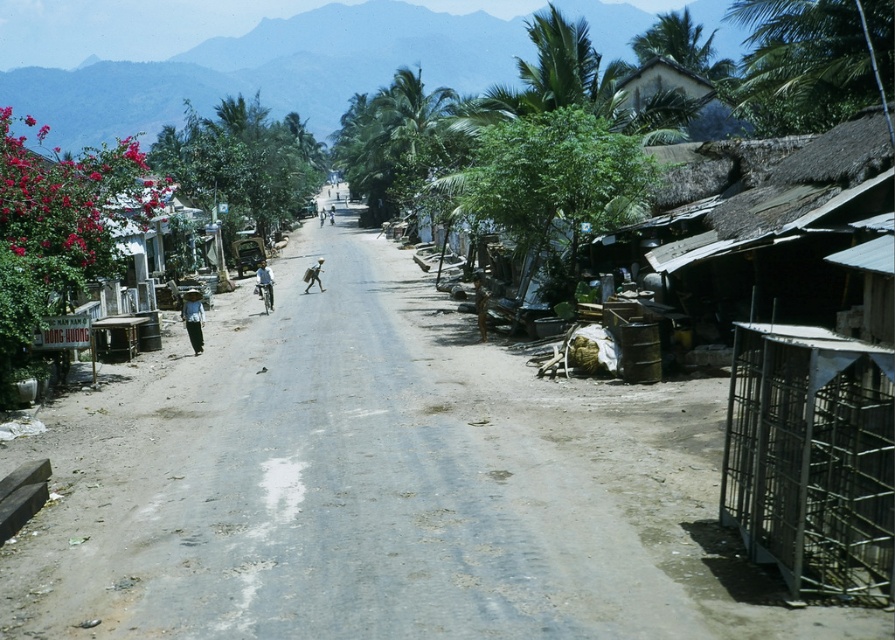
Can you confirm if dark blue fabric hat at center is positioned to the left of blue fabric shirt at center?

Incorrect, dark blue fabric hat at center is not on the left side of blue fabric shirt at center.

Can you confirm if dark blue fabric hat at center is shorter than blue fabric shirt at center?

Correct, dark blue fabric hat at center is not as tall as blue fabric shirt at center.

This screenshot has width=895, height=640. Describe the element at coordinates (193, 317) in the screenshot. I see `dark blue fabric hat at center` at that location.

This screenshot has height=640, width=895. In order to click on dark blue fabric hat at center in this screenshot , I will do `click(193, 317)`.

Identify the location of blue fabric shirt at center. (263, 284).

Identify the location of blue fabric shirt at center. (263, 284).

Is dark blue fabric hat at center positioned at the back of light brown fabric bag at center?

No, dark blue fabric hat at center is in front of light brown fabric bag at center.

Who is more forward, (186, 330) or (312, 273)?

Point (186, 330)

The width and height of the screenshot is (895, 640). Identify the location of dark blue fabric hat at center. [x=193, y=317].